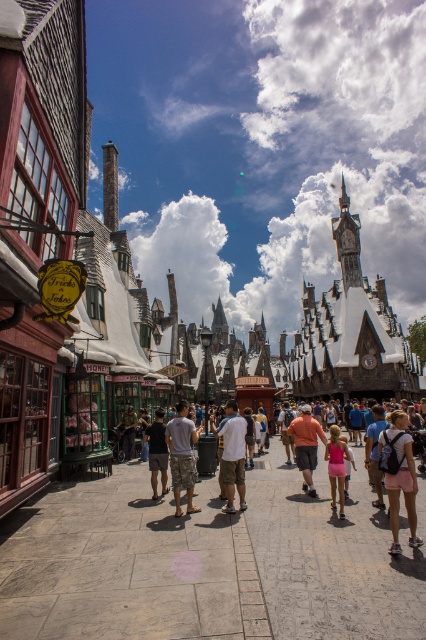
Question: Which of these objects is positioned farthest from the pink fabric dress at center?

Choices:
 (A) gray stone pavement at center
 (B) camouflage shorts at center
 (C) white cotton shirt at center
 (D) pink fabric backpack at lower right

Answer: (B)

Question: Estimate the real-world distances between objects in this image. Which object is closer to the pink fabric backpack at lower right?

Choices:
 (A) gray stone pavement at center
 (B) orange cotton t-shirt at center
 (C) white cotton shirt at center

Answer: (B)

Question: Where is gray stone pavement at center located in relation to dark gray shorts at center in the image?

Choices:
 (A) left
 (B) right

Answer: (B)

Question: Is pink fabric backpack at lower right positioned before pink fabric dress at center?

Choices:
 (A) no
 (B) yes

Answer: (B)

Question: Is gray stone pavement at center closer to the viewer compared to dark gray shorts at center?

Choices:
 (A) no
 (B) yes

Answer: (B)

Question: Which point is farther from the camera taking this photo?

Choices:
 (A) (230, 452)
 (B) (307, 424)
 (C) (164, 428)
 (D) (383, 465)

Answer: (B)